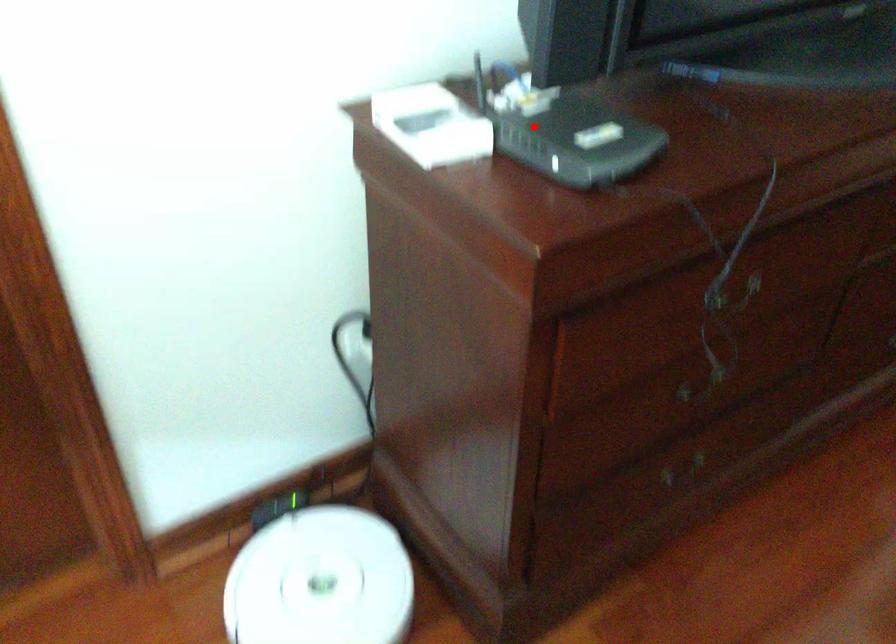
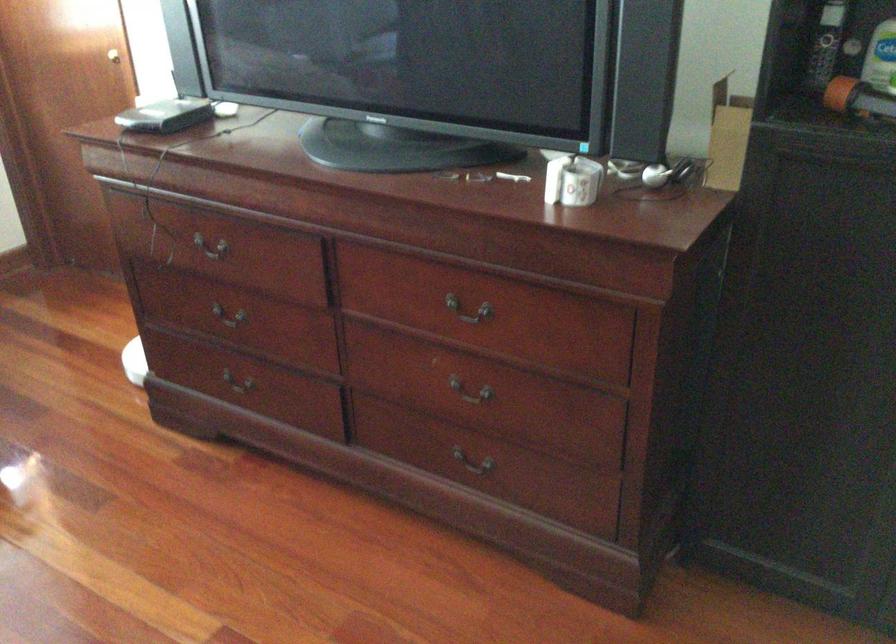
Question: I am providing you with two images of the same scene from different viewpoints. A red point is shown in image1. For the corresponding object point in image2, is it positioned nearer or farther from the camera?

Choices:
 (A) Nearer
 (B) Farther

Answer: (B)